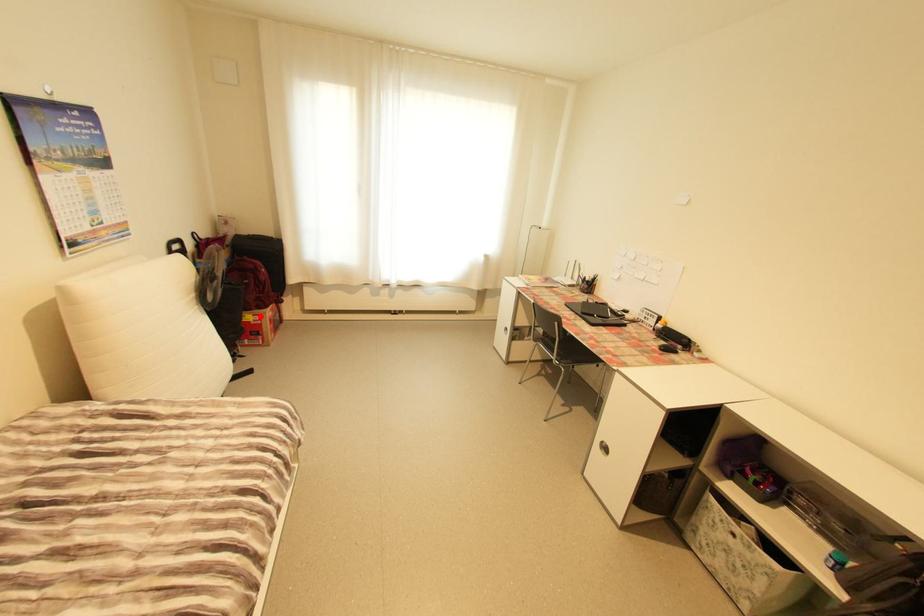
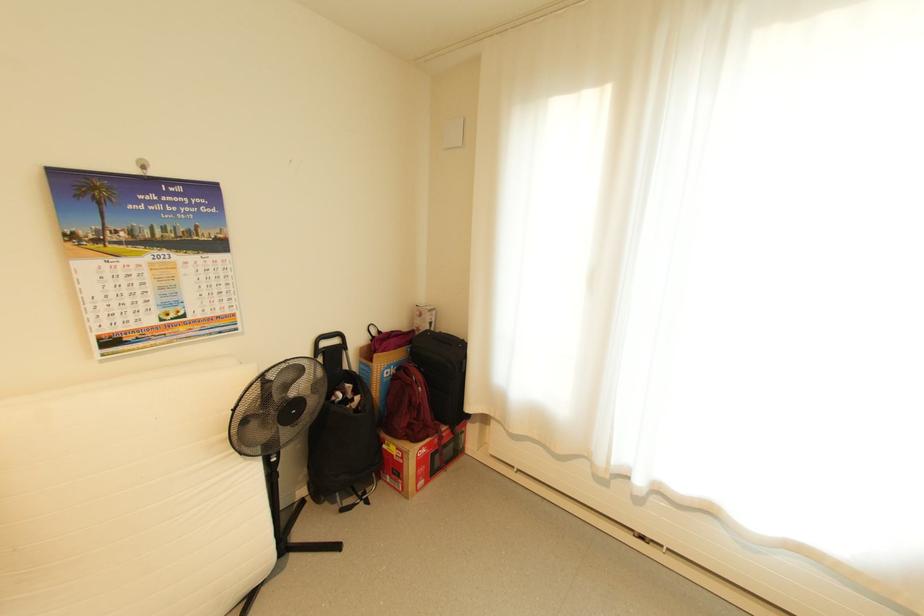
The point at the highlighted location is marked in the first image. Where is the corresponding point in the second image?

(404, 448)